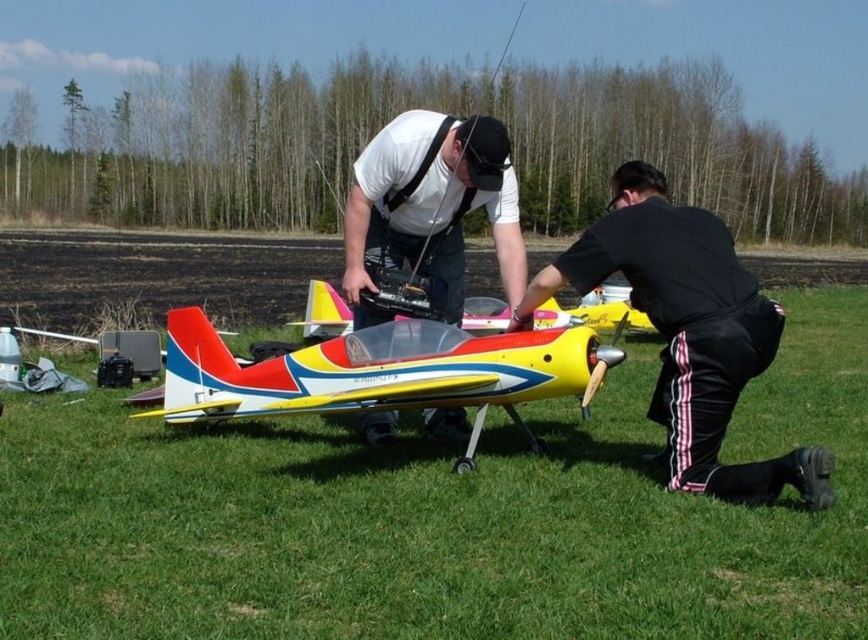
You are a photographer standing at the edge of the grassy field. You want to take a photo of the shiny plastic airplane at center without including the black matte pants at lower right in the frame. Based on their distance, is it possible to achieve this?

The black matte pants at lower right is 36.69 inches from the shiny plastic airplane at center. Since the distance between them is relatively close, it might be challenging to frame the photo so that the shiny plastic airplane at center is visible without including the black matte pants at lower right unless using a zoom lens or moving closer to the airplane.

You are standing on the grassy field and want to place a small toy between the green grass at lower center and the black matte pants at lower right. Which area has enough space to accommodate the toy?

The black matte pants at lower right has more space since it is larger than the green grass at lower center according to the description.

You are a photographer trying to capture a clear shot of the shiny plastic airplane at center without the black matte pants at lower right blocking the view. Based on their positions, can you position yourself so that the airplane is fully visible without the pants obstructing it?

The black matte pants at lower right is closer to the viewer than the shiny plastic airplane at center, so positioning yourself to avoid the pants might be challenging. However, by moving to a higher angle or shifting sideways, you could potentially frame the shot so the airplane at center appears above or beside the pants, ensuring it remains unobstructed.